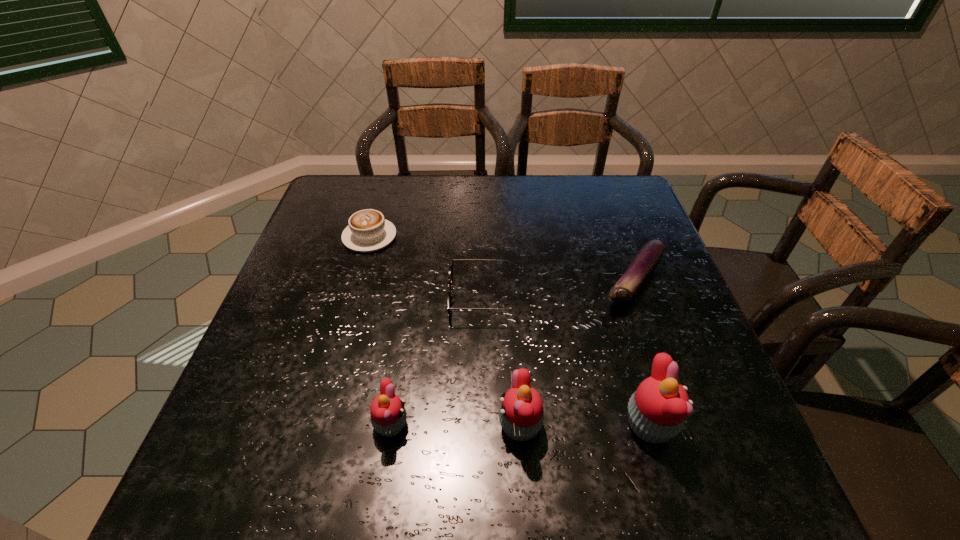
The height and width of the screenshot is (540, 960). I want to click on vacant space at the right edge of the desktop, so 607,260.

Image resolution: width=960 pixels, height=540 pixels. In the image, there is a desktop. Find the location of `vacant space at the far left corner`. vacant space at the far left corner is located at coordinates pyautogui.click(x=376, y=188).

You are a GUI agent. You are given a task and a screenshot of the screen. Output one action in this format:
    pyautogui.click(x=<x>, y=<y>)
    Task: Click on the free location at the near left corner of the desktop
    
    Given the screenshot: What is the action you would take?
    pyautogui.click(x=270, y=417)

This screenshot has height=540, width=960. I want to click on free location at the far right corner, so click(622, 190).

Image resolution: width=960 pixels, height=540 pixels. In order to click on free region at the near right corner in this screenshot , I will do pyautogui.click(x=701, y=424).

I want to click on free spot between the rightmost cupcake and the eggplant, so click(x=641, y=353).

Where is `free area in between the eggplant and the spectacles`? free area in between the eggplant and the spectacles is located at coordinates (560, 289).

The width and height of the screenshot is (960, 540). Identify the location of empty space that is in between the eggplant and the cappuccino. (501, 259).

Where is `free spot between the cappuccino and the fifth shortest object`? The width and height of the screenshot is (960, 540). free spot between the cappuccino and the fifth shortest object is located at coordinates (444, 331).

You are a GUI agent. You are given a task and a screenshot of the screen. Output one action in this format:
    pyautogui.click(x=<x>, y=<y>)
    Task: Click on the vacant area that lies between the leftmost cupcake and the eggplant
    
    Given the screenshot: What is the action you would take?
    pyautogui.click(x=512, y=353)